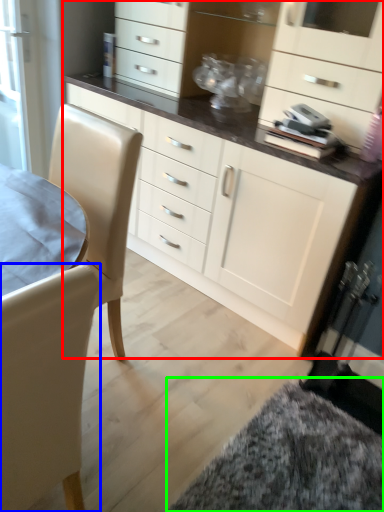
Question: Which is nearer to the cabinetry (highlighted by a red box)? chair (highlighted by a blue box) or wide (highlighted by a green box).

Choices:
 (A) chair
 (B) wide

Answer: (B)